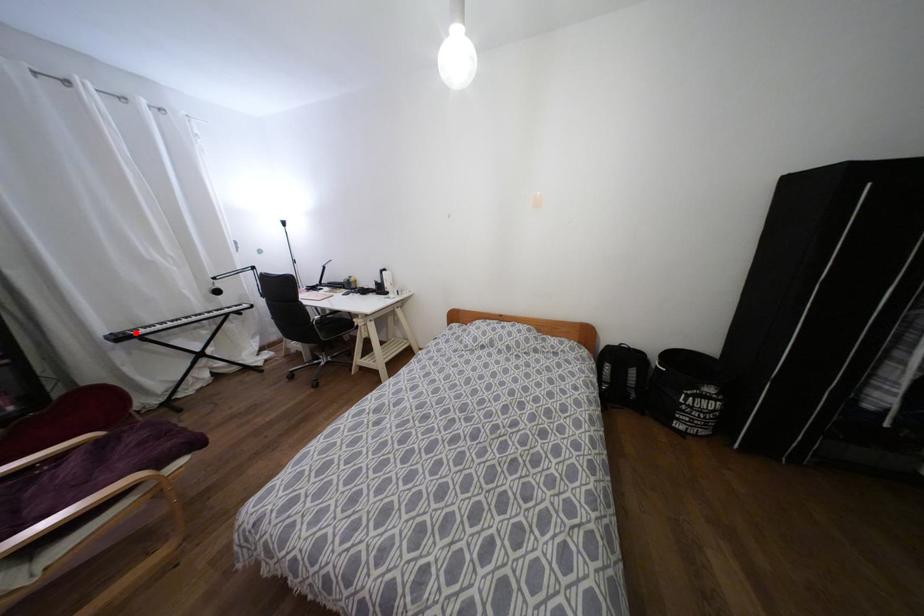
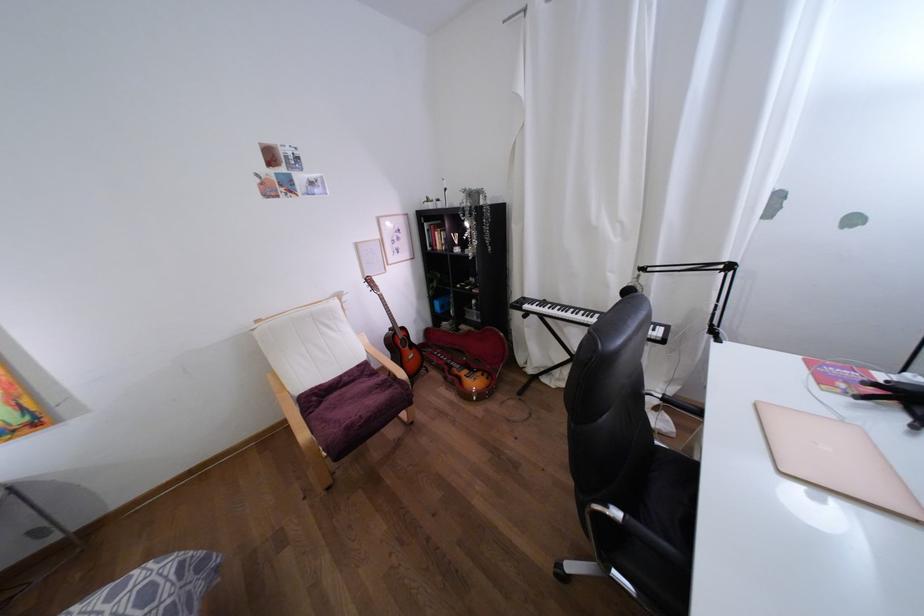
Find the pixel in the second image that matches the highlighted location in the first image.

(525, 306)